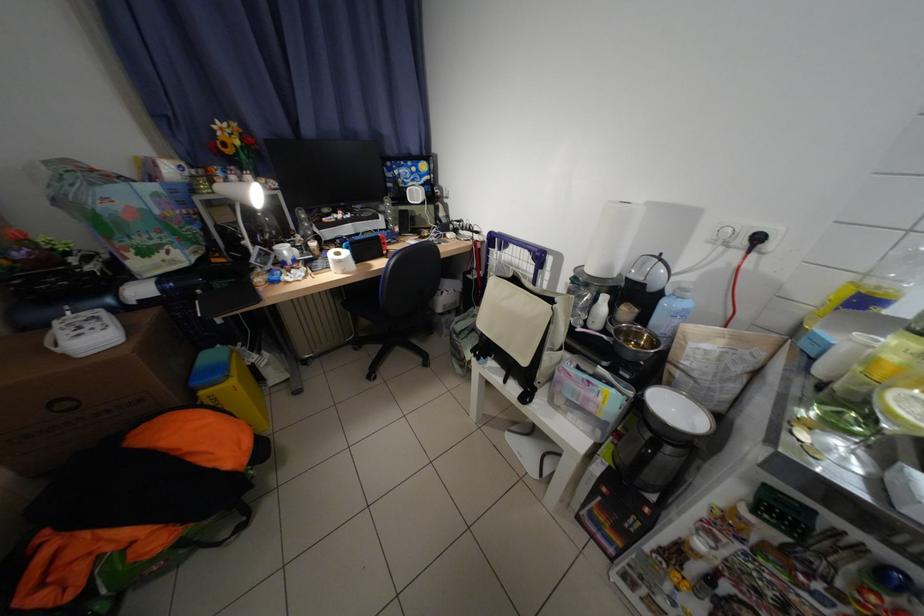
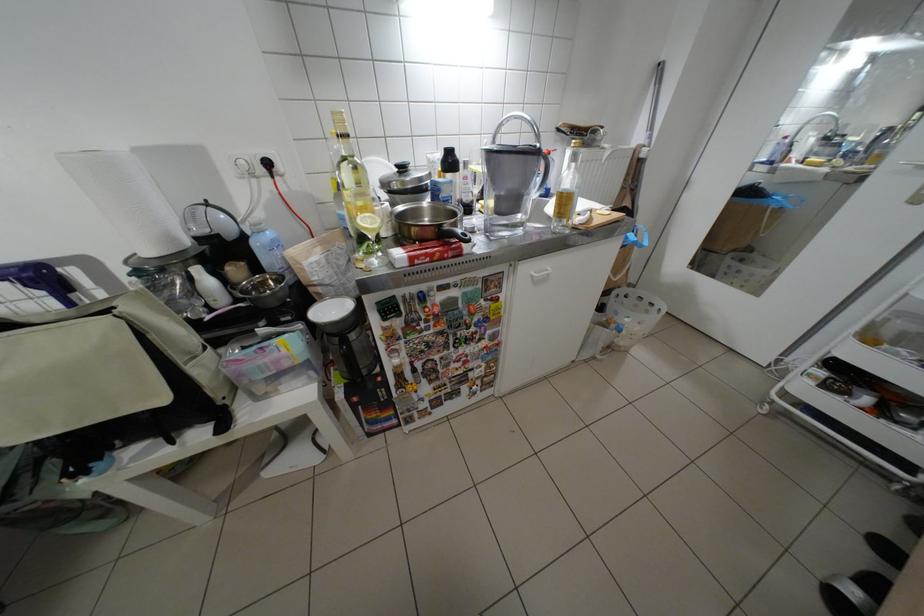
Based on the continuous images, in which direction is the camera rotating?

The camera's rotation is toward right-down.